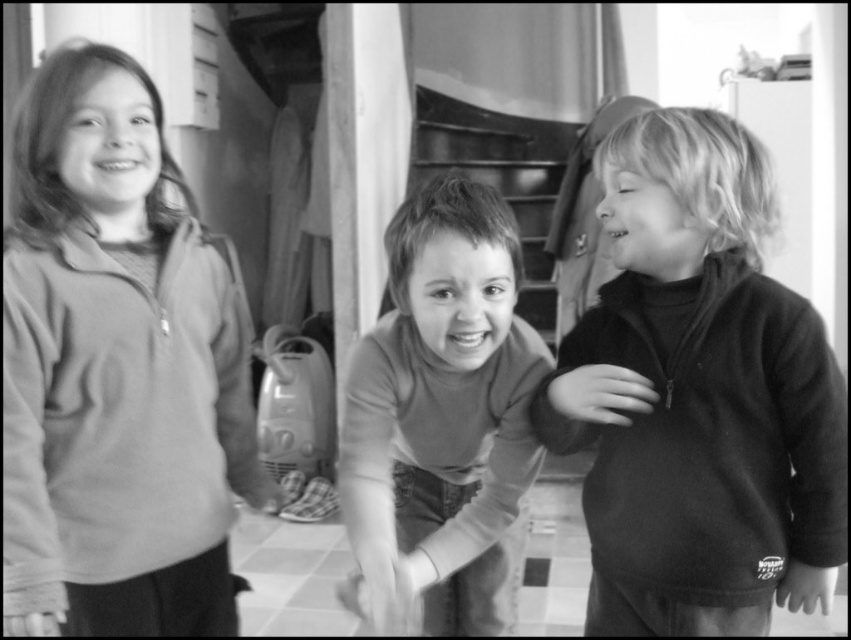
Is soft fleece sweatshirt at left below smooth brown shirt at center?

No.

Between soft fleece sweatshirt at left and smooth brown shirt at center, which one is positioned lower?

smooth brown shirt at center

Does point (134, 413) come behind point (510, 406)?

No, it is not.

At what (x,y) coordinates should I click in order to perform the action: click on soft fleece sweatshirt at left. Please return your answer as a coordinate pair (x, y). This screenshot has height=640, width=851. Looking at the image, I should click on (116, 371).

Which is above, velvet black sweater at right or smooth brown shirt at center?

Positioned higher is velvet black sweater at right.

Can you confirm if velvet black sweater at right is positioned to the right of smooth brown shirt at center?

Indeed, velvet black sweater at right is positioned on the right side of smooth brown shirt at center.

Is point (815, 525) farther from viewer compared to point (443, 532)?

No, (815, 525) is in front of (443, 532).

The width and height of the screenshot is (851, 640). In order to click on velvet black sweater at right in this screenshot , I will do (x=698, y=396).

Who is taller, soft fleece sweatshirt at left or velvet black sweater at right?

soft fleece sweatshirt at left

Between soft fleece sweatshirt at left and velvet black sweater at right, which one has less height?

velvet black sweater at right

At what (x,y) coordinates should I click in order to perform the action: click on soft fleece sweatshirt at left. Please return your answer as a coordinate pair (x, y). The image size is (851, 640). Looking at the image, I should click on (116, 371).